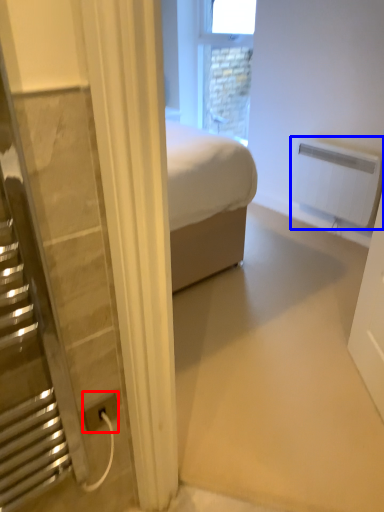
Question: Among these objects, which one is farthest to the camera, power plugs and sockets (highlighted by a red box) or radiator (highlighted by a blue box)?

Choices:
 (A) power plugs and sockets
 (B) radiator

Answer: (B)